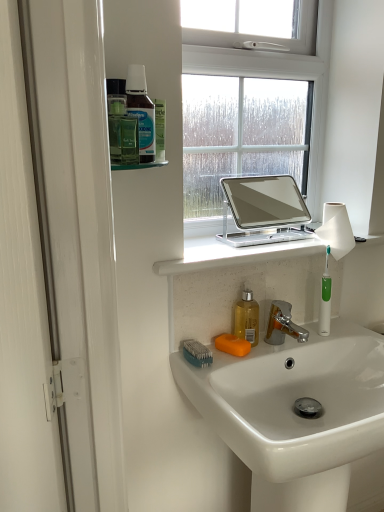
The width and height of the screenshot is (384, 512). Identify the location of free location to the right of orange matte soap at sink. (290, 345).